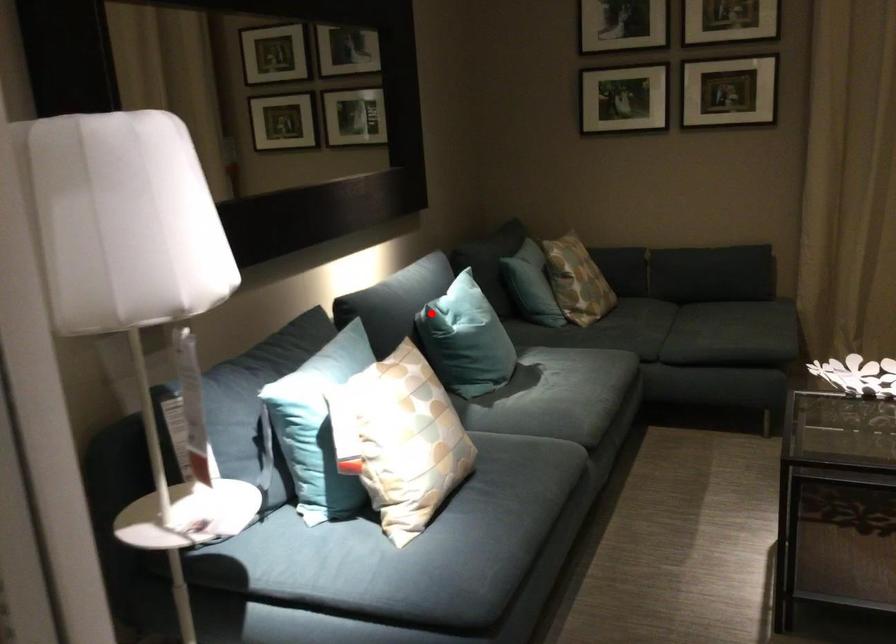
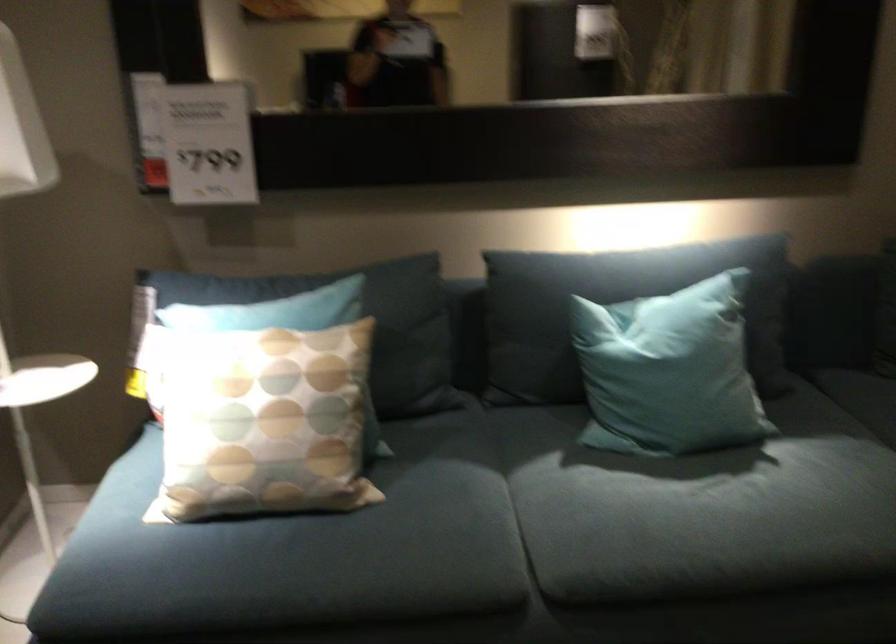
Question: A red point is marked in image1. In image2, is the corresponding 3D point closer to the camera or farther? Reply with the corresponding letter.

Choices:
 (A) The corresponding 3D point is closer.
 (B) The corresponding 3D point is farther.

Answer: (A)